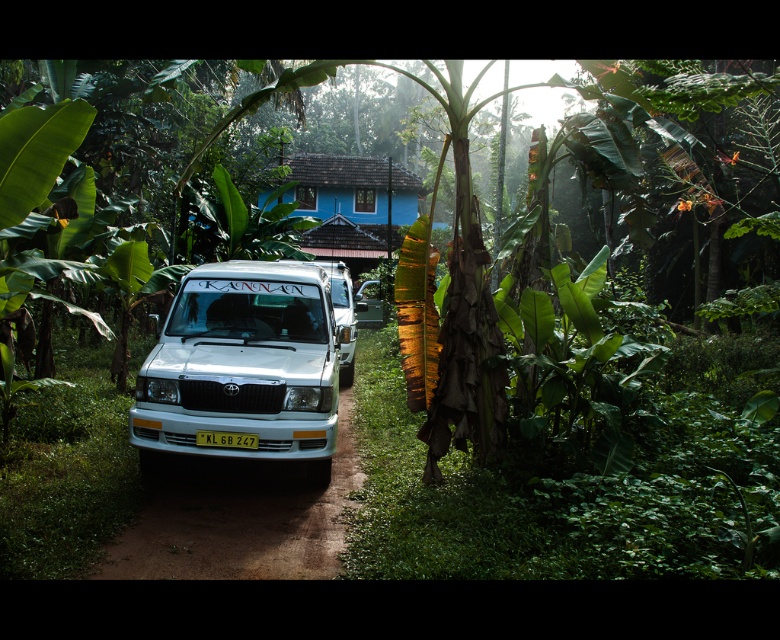
Question: Is white matte van at center bigger than blue painted wooden hut at center?

Choices:
 (A) yes
 (B) no

Answer: (B)

Question: Does white matte van at center appear under blue painted wooden hut at center?

Choices:
 (A) yes
 (B) no

Answer: (A)

Question: Is white matte van at center positioned behind yellow plastic license plate at center?

Choices:
 (A) no
 (B) yes

Answer: (A)

Question: Which object is the closest to the brown dirt track at center?

Choices:
 (A) yellow plastic license plate at center
 (B) white matte van at center
 (C) blue painted wooden hut at center

Answer: (A)

Question: Which point appears farthest from the camera in this image?

Choices:
 (A) (158, 346)
 (B) (204, 483)

Answer: (A)

Question: Which point appears closest to the camera in this image?

Choices:
 (A) (335, 257)
 (B) (236, 444)
 (C) (234, 316)

Answer: (B)